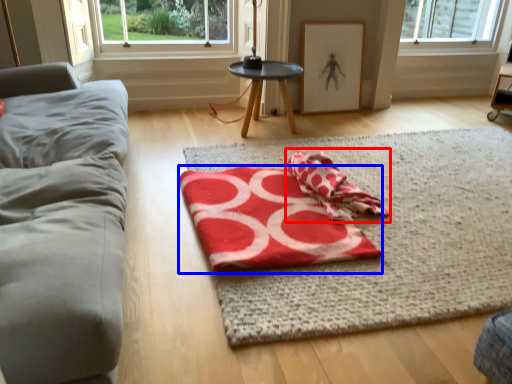
Question: Which point is further to the camera, beach towel (highlighted by a red box) or beach towel (highlighted by a blue box)?

Choices:
 (A) beach towel
 (B) beach towel

Answer: (A)